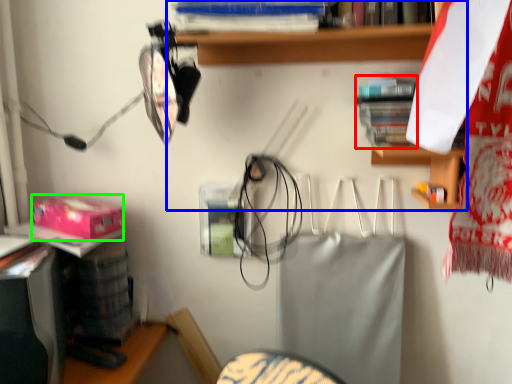
Question: Considering the real-world distances, which object is closest to book (highlighted by a red box)? shelf (highlighted by a blue box) or box (highlighted by a green box).

Choices:
 (A) shelf
 (B) box

Answer: (A)